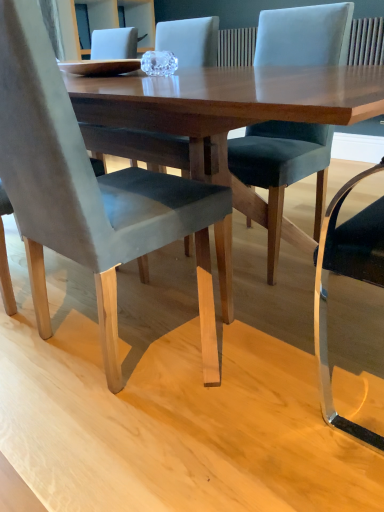
The height and width of the screenshot is (512, 384). Identify the location of free space in front of velvet grey chair at lower left, which is the second chair from right to left. (148, 444).